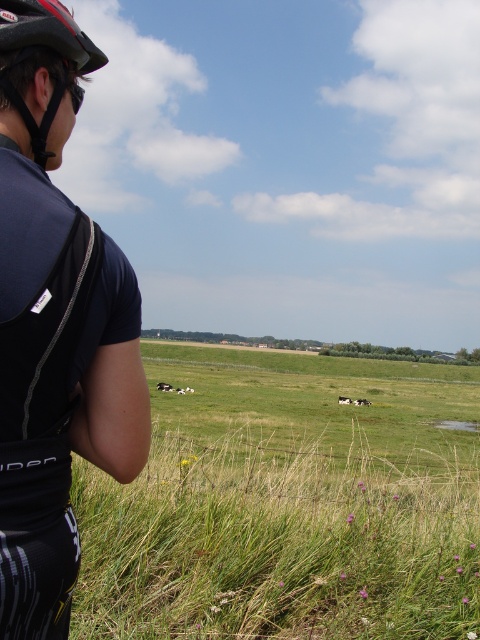
Is matte black cycling jersey at left below matte black helmet at upper left?

Indeed, matte black cycling jersey at left is positioned under matte black helmet at upper left.

Can you confirm if matte black cycling jersey at left is bigger than matte black helmet at upper left?

Correct, matte black cycling jersey at left is larger in size than matte black helmet at upper left.

Is point (31, 1) farther from viewer compared to point (57, 51)?

No.

Find the location of a particular element. The height and width of the screenshot is (640, 480). matte black cycling jersey at left is located at coordinates (55, 324).